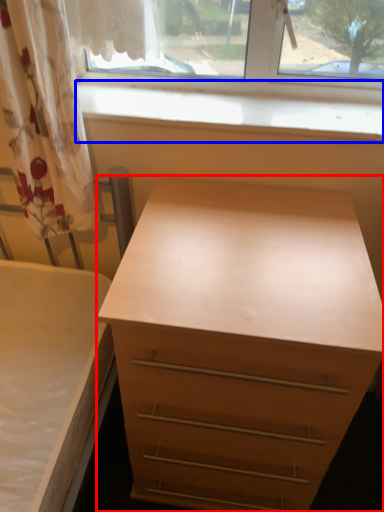
Question: Which of the following is the closest to the observer, chest of drawers (highlighted by a red box) or window sill (highlighted by a blue box)?

Choices:
 (A) chest of drawers
 (B) window sill

Answer: (A)